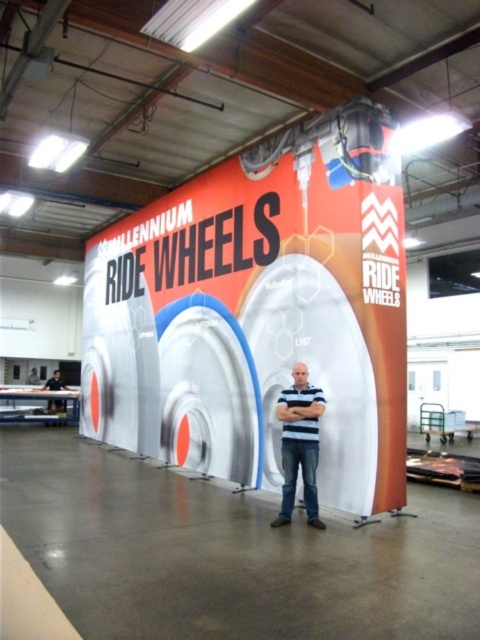
You are organizing a charity clothing drive and have two shirts in front of you. You need to determine which shirt has a bigger size. The shirts are the striped cotton shirt at center and the blue striped shirt at center. Which one is larger?

The striped cotton shirt at center is larger than the blue striped shirt at center.

Where is the white glossy sign at center located in 2D coordinates?

The white glossy sign at center is located at the 2D coordinates of point (261,314).